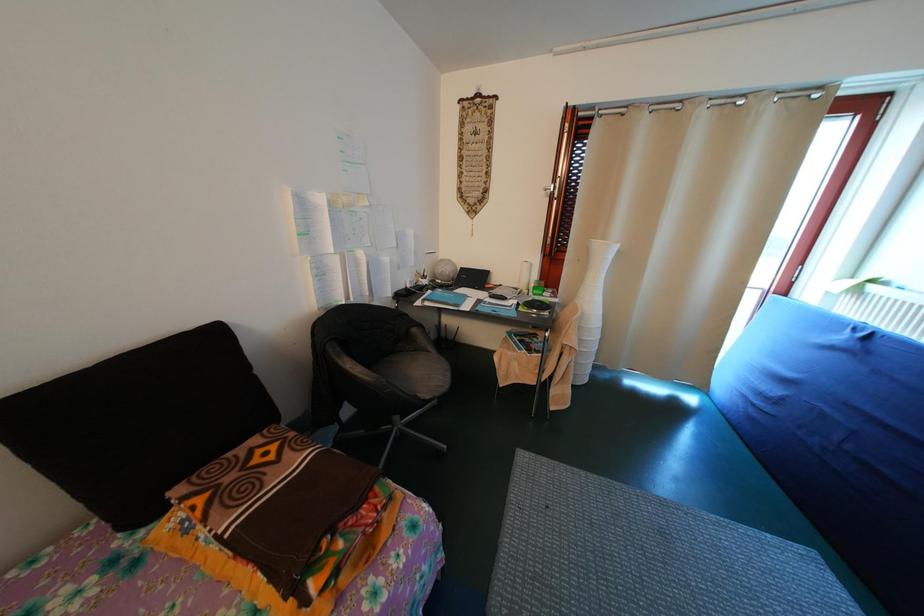
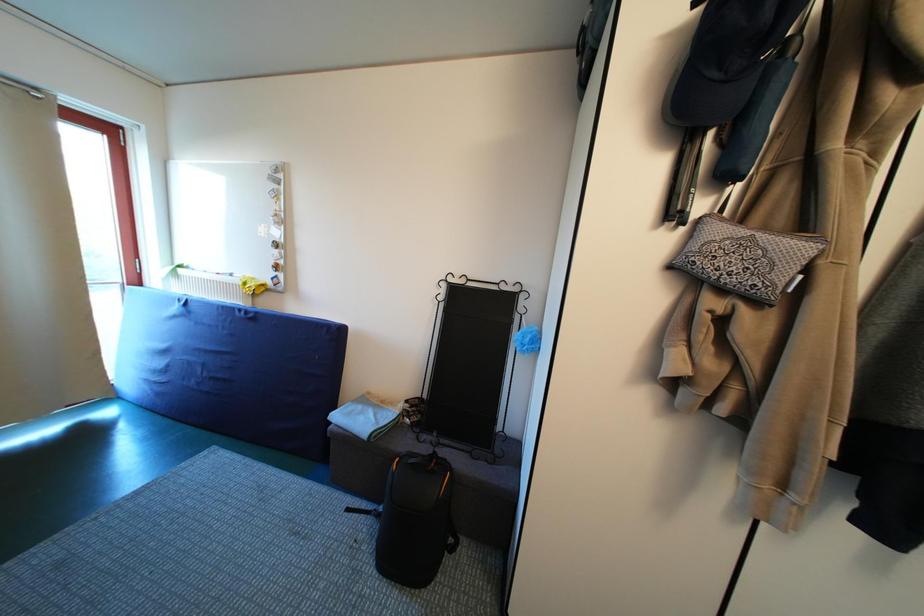
Question: The images are taken continuously from a first-person perspective. In which direction is your viewpoint rotating?

Choices:
 (A) Left
 (B) Right
 (C) Up
 (D) Down

Answer: (B)